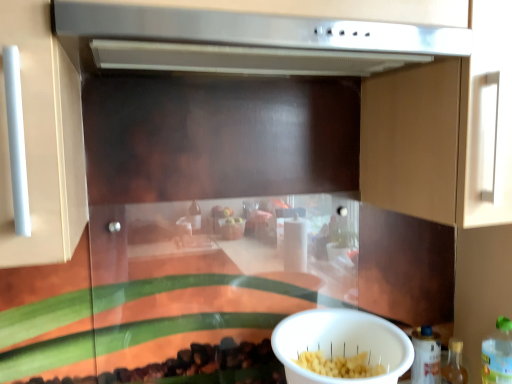
In order to click on translucent plastic bottle at lower right, which appears as the first bottle when viewed from the left in this screenshot , I will do tap(426, 356).

How much space does translucent plastic bottle at lower right, positioned as the second bottle in right-to-left order, occupy horizontally?

The width of translucent plastic bottle at lower right, positioned as the second bottle in right-to-left order, is 2.61 inches.

Measure the distance between point (x=500, y=372) and camera.

They are 34.06 inches apart.

I want to click on white plastic bowl at lower center, so click(x=341, y=344).

Which of these two, stainless steel vent at upper center or white plastic bowl at lower center, is bigger?

stainless steel vent at upper center is bigger.

From the image's perspective, between stainless steel vent at upper center and white plastic bowl at lower center, which one is located above?

stainless steel vent at upper center appears higher in the image.

Could you tell me if stainless steel vent at upper center is turned towards white plastic bowl at lower center?

No.

Between stainless steel vent at upper center and white plastic bowl at lower center, which one is positioned in front?

stainless steel vent at upper center is closer to the camera.

Can you tell me how much translucent plastic bottle at lower right, the third bottle from the left, and translucent plastic bottle at lower right, which appears as the first bottle when viewed from the left, differ in facing direction?

0.00604 degrees.

Is translucent plastic bottle at lower right, the 1th bottle from the right, to the right of translucent plastic bottle at lower right, the third bottle in the right-to-left sequence, from the viewer's perspective?

Indeed, translucent plastic bottle at lower right, the 1th bottle from the right, is positioned on the right side of translucent plastic bottle at lower right, the third bottle in the right-to-left sequence.

Image resolution: width=512 pixels, height=384 pixels. In order to click on the 2nd bottle in front when counting from the translucent plastic bottle at lower right, which appears as the first bottle when viewed from the left in this screenshot , I will do `click(497, 354)`.

Between white plastic bowl at lower center and translucent plastic bottle at lower right, which appears as the first bottle when viewed from the left, which one has smaller width?

With smaller width is translucent plastic bottle at lower right, which appears as the first bottle when viewed from the left.

Is white plastic bowl at lower center to the left or to the right of translucent plastic bottle at lower right, which appears as the first bottle when viewed from the left, in the image?

white plastic bowl at lower center is positioned on translucent plastic bottle at lower right, which appears as the first bottle when viewed from the left,'s left side.

Are white plastic bowl at lower center and translucent plastic bottle at lower right, the third bottle in the right-to-left sequence, far apart?

No.

From the picture: Is white plastic bowl at lower center positioned beyond the bounds of translucent plastic bottle at lower right, which appears as the first bottle when viewed from the left?

white plastic bowl at lower center lies outside translucent plastic bottle at lower right, which appears as the first bottle when viewed from the left,'s area.

Between translucent plastic bottle at lower right, arranged as the second bottle when viewed from the left, and translucent plastic bottle at lower right, the third bottle in the right-to-left sequence, which one is positioned behind?

translucent plastic bottle at lower right, the third bottle in the right-to-left sequence.

Which point is more distant from viewer, (458, 351) or (439, 354)?

The point (439, 354) is farther.

Is translucent plastic bottle at lower right, arranged as the second bottle when viewed from the left, not within translucent plastic bottle at lower right, which appears as the first bottle when viewed from the left?

Yes, translucent plastic bottle at lower right, arranged as the second bottle when viewed from the left, is outside of translucent plastic bottle at lower right, which appears as the first bottle when viewed from the left.

Consider the image. From the image's perspective, is translucent plastic bottle at lower right, positioned as the second bottle in right-to-left order, positioned above or below translucent plastic bottle at lower right, the third bottle from the left?

From the image's perspective, translucent plastic bottle at lower right, positioned as the second bottle in right-to-left order, appears below translucent plastic bottle at lower right, the third bottle from the left.

Considering the sizes of objects translucent plastic bottle at lower right, arranged as the second bottle when viewed from the left, and translucent plastic bottle at lower right, the third bottle from the left, in the image provided, who is wider, translucent plastic bottle at lower right, arranged as the second bottle when viewed from the left, or translucent plastic bottle at lower right, the third bottle from the left,?

translucent plastic bottle at lower right, the third bottle from the left, is wider.

Is translucent plastic bottle at lower right, arranged as the second bottle when viewed from the left, facing away from translucent plastic bottle at lower right, the third bottle from the left?

That's not correct — translucent plastic bottle at lower right, arranged as the second bottle when viewed from the left, is not looking away from translucent plastic bottle at lower right, the third bottle from the left.

Does translucent plastic bottle at lower right, arranged as the second bottle when viewed from the left, come behind translucent plastic bottle at lower right, the 1th bottle from the right?

Yes.

I want to click on the 1st bottle to the left of the translucent plastic bottle at lower right, the 1th bottle from the right, counting from the anchor's position, so click(454, 364).

Is translucent plastic bottle at lower right, positioned as the second bottle in right-to-left order, at the back of translucent plastic bottle at lower right, the 1th bottle from the right?

No.

Is translucent plastic bottle at lower right, the third bottle from the left, spatially inside translucent plastic bottle at lower right, arranged as the second bottle when viewed from the left, or outside of it?

translucent plastic bottle at lower right, the third bottle from the left, cannot be found inside translucent plastic bottle at lower right, arranged as the second bottle when viewed from the left.

Does point (496, 332) come in front of point (446, 372)?

Yes, it is.

What's the angular difference between stainless steel vent at upper center and translucent plastic bottle at lower right, positioned as the second bottle in right-to-left order,'s facing directions?

0.00435 degrees separate the facing orientations of stainless steel vent at upper center and translucent plastic bottle at lower right, positioned as the second bottle in right-to-left order.

Considering the relative sizes of stainless steel vent at upper center and translucent plastic bottle at lower right, arranged as the second bottle when viewed from the left, in the image provided, is stainless steel vent at upper center smaller than translucent plastic bottle at lower right, arranged as the second bottle when viewed from the left,?

No.

Is stainless steel vent at upper center aimed at translucent plastic bottle at lower right, positioned as the second bottle in right-to-left order?

No, stainless steel vent at upper center is not facing towards translucent plastic bottle at lower right, positioned as the second bottle in right-to-left order.

At what (x,y) coordinates should I click in order to perform the action: click on vent on the left of white plastic bowl at lower center. Please return your answer as a coordinate pair (x, y). The height and width of the screenshot is (384, 512). Looking at the image, I should click on (249, 41).

The height and width of the screenshot is (384, 512). Identify the location of bottle above the translucent plastic bottle at lower right, the third bottle in the right-to-left sequence (from a real-world perspective). click(x=497, y=354).

Estimate the real-world distances between objects in this image. Which object is closer to translucent plastic bottle at lower right, the third bottle in the right-to-left sequence, translucent plastic bottle at lower right, positioned as the second bottle in right-to-left order, or white plastic bowl at lower center?

Based on the image, translucent plastic bottle at lower right, positioned as the second bottle in right-to-left order, appears to be nearer to translucent plastic bottle at lower right, the third bottle in the right-to-left sequence.

Considering their positions, is translucent plastic bottle at lower right, the third bottle in the right-to-left sequence, positioned further to translucent plastic bottle at lower right, arranged as the second bottle when viewed from the left, than translucent plastic bottle at lower right, the third bottle from the left?

Based on the image, translucent plastic bottle at lower right, the third bottle from the left, appears to be further to translucent plastic bottle at lower right, arranged as the second bottle when viewed from the left.

When comparing their distances from white plastic bowl at lower center, does stainless steel vent at upper center or translucent plastic bottle at lower right, the 1th bottle from the right, seem further?

Among the two, stainless steel vent at upper center is located further to white plastic bowl at lower center.

Considering their positions, is translucent plastic bottle at lower right, which appears as the first bottle when viewed from the left, positioned closer to stainless steel vent at upper center than translucent plastic bottle at lower right, the 1th bottle from the right?

translucent plastic bottle at lower right, the 1th bottle from the right.

Looking at the image, which one is located further to translucent plastic bottle at lower right, positioned as the second bottle in right-to-left order, stainless steel vent at upper center or white plastic bowl at lower center?

Based on the image, stainless steel vent at upper center appears to be further to translucent plastic bottle at lower right, positioned as the second bottle in right-to-left order.

Considering their positions, is white plastic bowl at lower center positioned further to translucent plastic bottle at lower right, which appears as the first bottle when viewed from the left, than stainless steel vent at upper center?

stainless steel vent at upper center is further to translucent plastic bottle at lower right, which appears as the first bottle when viewed from the left.

From the image, which object appears to be farther from translucent plastic bottle at lower right, the third bottle from the left, translucent plastic bottle at lower right, which appears as the first bottle when viewed from the left, or stainless steel vent at upper center?

stainless steel vent at upper center is further to translucent plastic bottle at lower right, the third bottle from the left.

Based on their spatial positions, is translucent plastic bottle at lower right, the third bottle from the left, or white plastic bowl at lower center further from translucent plastic bottle at lower right, which appears as the first bottle when viewed from the left?

Based on the image, white plastic bowl at lower center appears to be further to translucent plastic bottle at lower right, which appears as the first bottle when viewed from the left.

Locate an element on the screen. The image size is (512, 384). bowl between stainless steel vent at upper center and translucent plastic bottle at lower right, positioned as the second bottle in right-to-left order, from top to bottom is located at coordinates (341, 344).

Identify the location of bottle located between translucent plastic bottle at lower right, which appears as the first bottle when viewed from the left, and translucent plastic bottle at lower right, the third bottle from the left, in the left-right direction. This screenshot has height=384, width=512. (454, 364).

The image size is (512, 384). Identify the location of bottle that lies between stainless steel vent at upper center and translucent plastic bottle at lower right, which appears as the first bottle when viewed from the left, from top to bottom. (497, 354).

The image size is (512, 384). Find the location of `bottle between white plastic bowl at lower center and translucent plastic bottle at lower right, positioned as the second bottle in right-to-left order, in the horizontal direction`. bottle between white plastic bowl at lower center and translucent plastic bottle at lower right, positioned as the second bottle in right-to-left order, in the horizontal direction is located at coordinates (426, 356).